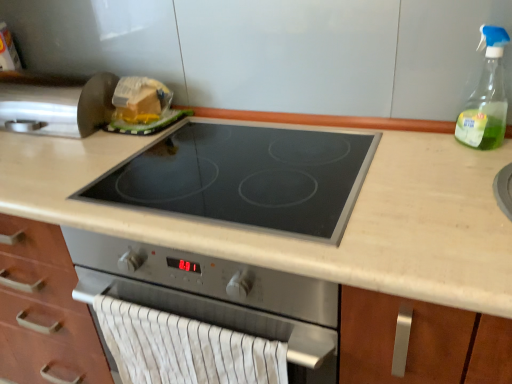
Find the location of a particular element. blank area to the left of clear glass spray bottle at upper right is located at coordinates (415, 151).